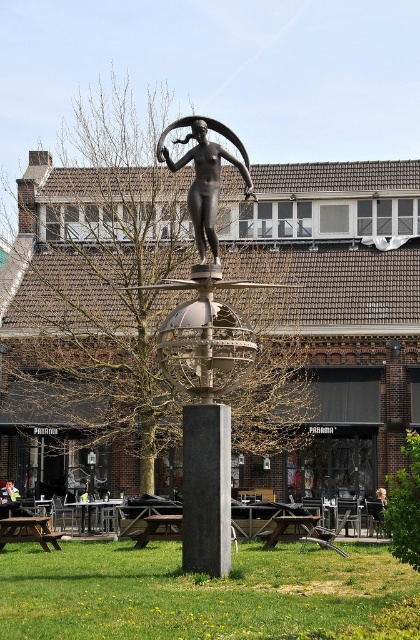
Measure the distance from brown leafless tree at center to bronze statue at center.

brown leafless tree at center and bronze statue at center are 45.96 feet apart from each other.

Does brown leafless tree at center have a lesser height compared to bronze statue at center?

No.

Between point (102, 314) and point (212, 163), which one is positioned behind?

Point (102, 314)

Where is `brown leafless tree at center`? This screenshot has height=640, width=420. brown leafless tree at center is located at coordinates tap(104, 284).

Based on the photo, is brown leafless tree at center taller than smooth gray pole at center?

Yes.

Who is more forward, [28,289] or [210,406]?

Positioned in front is point [210,406].

Identify the location of brown leafless tree at center. (104, 284).

Can you confirm if polished bronze sculpture at center is taller than bronze statue at center?

Indeed, polished bronze sculpture at center has a greater height compared to bronze statue at center.

Can you confirm if polished bronze sculpture at center is shorter than bronze statue at center?

In fact, polished bronze sculpture at center may be taller than bronze statue at center.

The image size is (420, 640). What do you see at coordinates (205, 408) in the screenshot?
I see `polished bronze sculpture at center` at bounding box center [205, 408].

Where is `polished bronze sculpture at center`? The height and width of the screenshot is (640, 420). polished bronze sculpture at center is located at coordinates (205, 408).